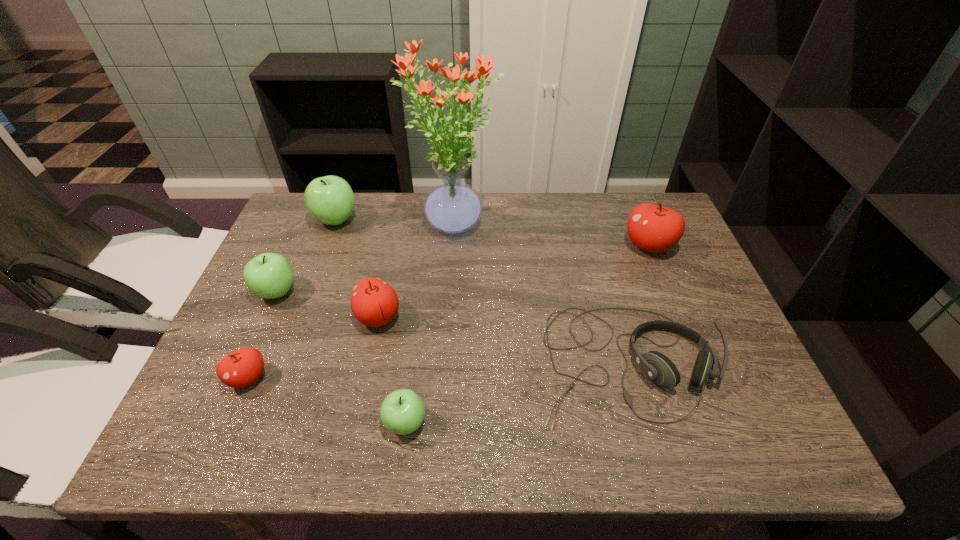
Where is `free point between the nearest green apple and the headset`? Image resolution: width=960 pixels, height=540 pixels. free point between the nearest green apple and the headset is located at coordinates (516, 393).

What are the coordinates of `vacant point located between the leftmost red apple and the rightmost red apple` in the screenshot? It's located at (448, 312).

Identify the location of blank region between the nearest green apple and the farthest red apple. (527, 334).

Image resolution: width=960 pixels, height=540 pixels. What are the coordinates of `empty space that is in between the headset and the second nearest red apple` in the screenshot? It's located at (502, 340).

Find the location of `vacant area between the second nearest green apple and the rightmost apple`. vacant area between the second nearest green apple and the rightmost apple is located at coordinates (463, 269).

Where is `the seventh closest object relative to the rightmost red apple`? The width and height of the screenshot is (960, 540). the seventh closest object relative to the rightmost red apple is located at coordinates (242, 367).

Image resolution: width=960 pixels, height=540 pixels. I want to click on object that ranks as the second closest to the nearest green apple, so click(656, 366).

Select which apple is the second closest to the smallest green apple. Please provide its 2D coordinates. Your answer should be formatted as a tuple, i.e. [(x, y)], where the tuple contains the x and y coordinates of a point satisfying the conditions above.

[(242, 367)]

I want to click on apple that is the fourth closest to the biggest red apple, so click(x=269, y=275).

Image resolution: width=960 pixels, height=540 pixels. What are the coordinates of `the closest red apple to the second biggest green apple` in the screenshot? It's located at (242, 367).